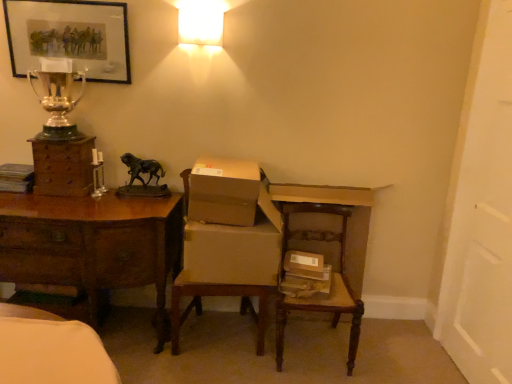
This screenshot has height=384, width=512. Find the location of `vacant space situated above white frosted glass at upper center (from a real-world perspective)`. vacant space situated above white frosted glass at upper center (from a real-world perspective) is located at coordinates (198, 7).